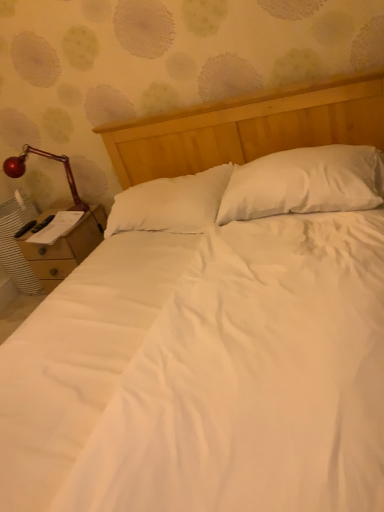
Find the location of a particular element. The width and height of the screenshot is (384, 512). empty space that is ontop of wooden nightstand at left (from a real-world perspective) is located at coordinates (46, 225).